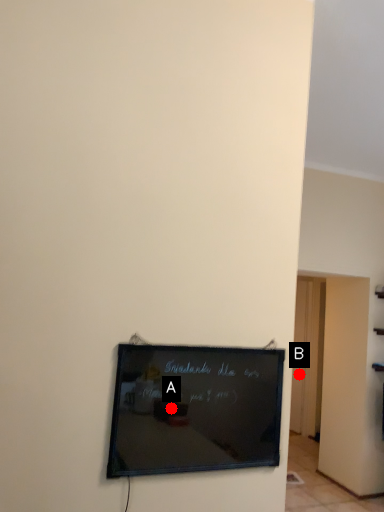
Question: Two points are circled on the image, labeled by A and B beside each circle. Which point is farther to the camera?

Choices:
 (A) A is further
 (B) B is further

Answer: (B)